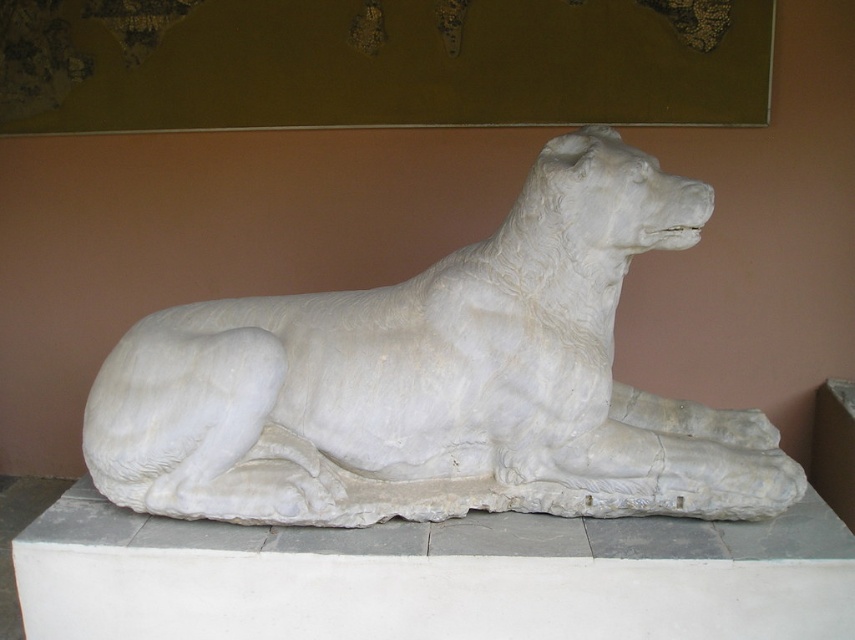
You are standing in front of the marble sculpture of a reclining dog. There are two points marked on the sculpture, one at coordinates point (187, 490) and the other at point (221, 595). Which point is closer to you?

Point (187, 490) is further to the camera than point (221, 595). Therefore, point (221, 595) is closer to you.

From the picture: You are an art curator planning to display both the white marble lion at center and the white marble dog at center in a gallery. Given their heights, which one would require a taller base to ensure proper visibility for visitors?

The white marble lion at center requires a taller base because it has a greater height compared to the white marble dog at center.